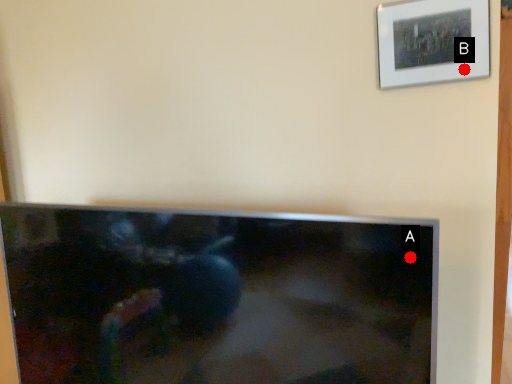
Question: Two points are circled on the image, labeled by A and B beside each circle. Which point is closer to the camera?

Choices:
 (A) A is closer
 (B) B is closer

Answer: (A)